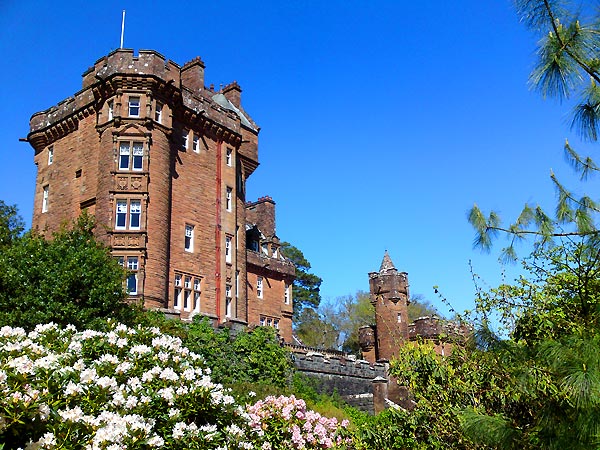
In order to click on top story windows in this screenshot , I will do `click(105, 110)`, `click(131, 102)`, `click(157, 106)`, `click(181, 135)`, `click(198, 140)`, `click(232, 158)`, `click(48, 154)`.